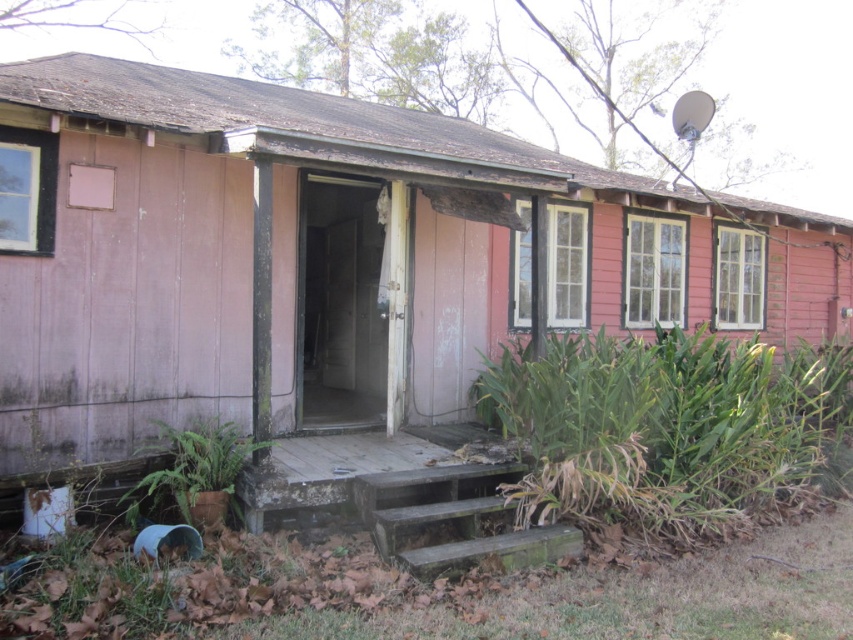
Between pink wood house at center and green leafy plant at lower right, which one has more height?

Standing taller between the two is pink wood house at center.

Is pink wood house at center closer to camera compared to green leafy plant at lower right?

Yes, it is in front of green leafy plant at lower right.

Is point (467, 248) more distant than point (744, 396)?

Yes, it is behind point (744, 396).

The height and width of the screenshot is (640, 853). What are the coordinates of `pink wood house at center` in the screenshot? It's located at click(329, 257).

Which is above, dark green concrete stairs at center or green leafy plant at lower left?

green leafy plant at lower left is above.

Does dark green concrete stairs at center have a smaller size compared to green leafy plant at lower left?

No.

Is point (463, 502) closer to camera compared to point (167, 449)?

Yes, point (463, 502) is in front of point (167, 449).

At what (x,y) coordinates should I click in order to perform the action: click on dark green concrete stairs at center. Please return your answer as a coordinate pair (x, y). The width and height of the screenshot is (853, 640). Looking at the image, I should click on click(x=453, y=518).

Does green leafy plant at lower right lie behind dark green concrete stairs at center?

Yes, it is.

Does green leafy plant at lower right appear over dark green concrete stairs at center?

Indeed, green leafy plant at lower right is positioned over dark green concrete stairs at center.

Which is behind, point (790, 380) or point (440, 554)?

Positioned behind is point (790, 380).

This screenshot has height=640, width=853. What are the coordinates of `green leafy plant at lower right` in the screenshot? It's located at (665, 428).